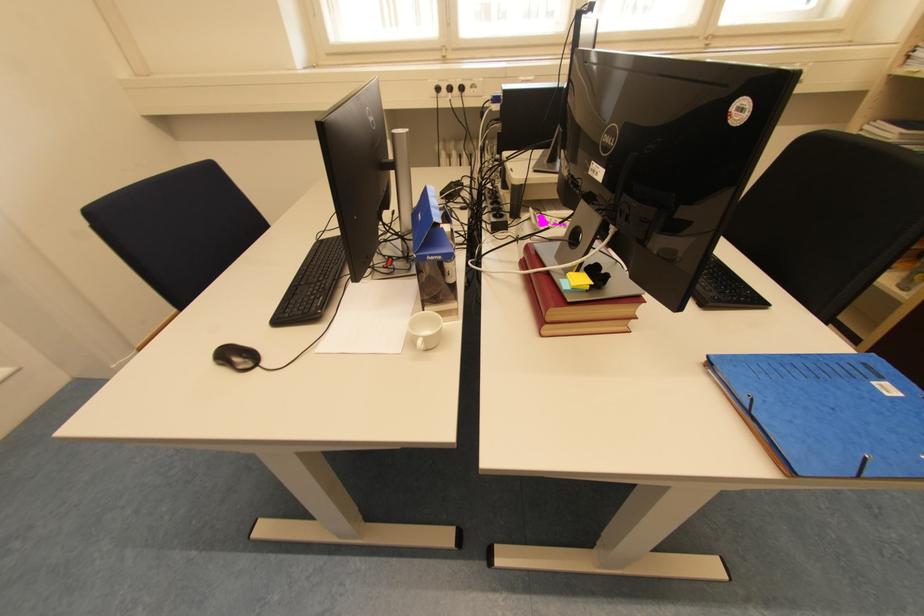
This screenshot has width=924, height=616. I want to click on blue cardboard box, so click(828, 411).